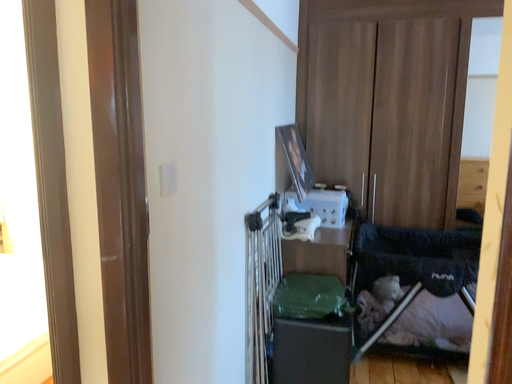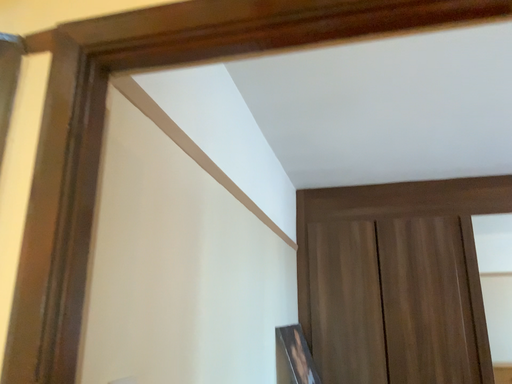
Question: Which way did the camera rotate in the video?

Choices:
 (A) rotated downward
 (B) rotated upward

Answer: (B)